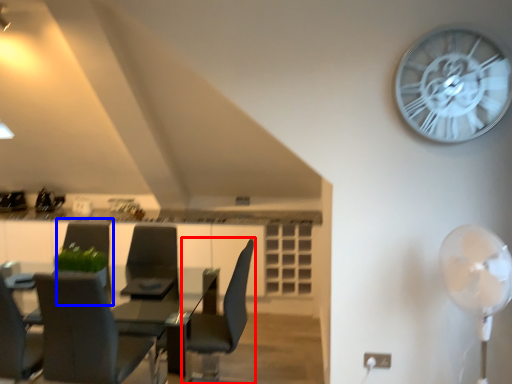
Question: Among these objects, which one is farthest to the camera, chair (highlighted by a red box) or armchair (highlighted by a blue box)?

Choices:
 (A) chair
 (B) armchair

Answer: (B)